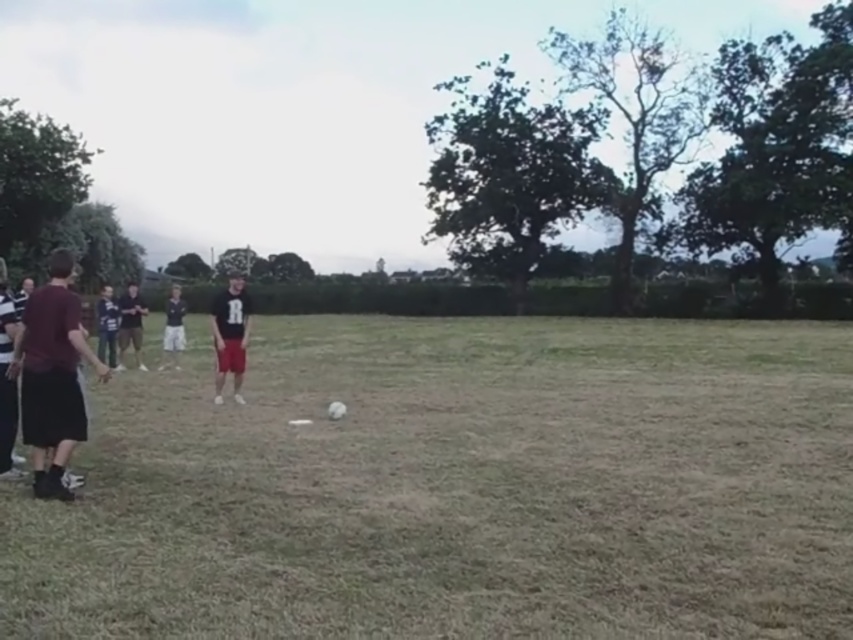
What are the coordinates of the grassy field at lower left in the image?

The grassy field at lower left is located at coordinates point (457,486).

What are the coordinates of the grassy field at lower left in the image?

The grassy field at lower left is located at coordinates point [457,486].

You are a photographer trying to capture the entire scene of the grassy field at lower left and the dark gray shirt at left. Which object should you focus on first to ensure both are in frame?

The grassy field at lower left has a larger size compared to dark gray shirt at left, so you should focus on the grassy field at lower left first to ensure both are in frame.